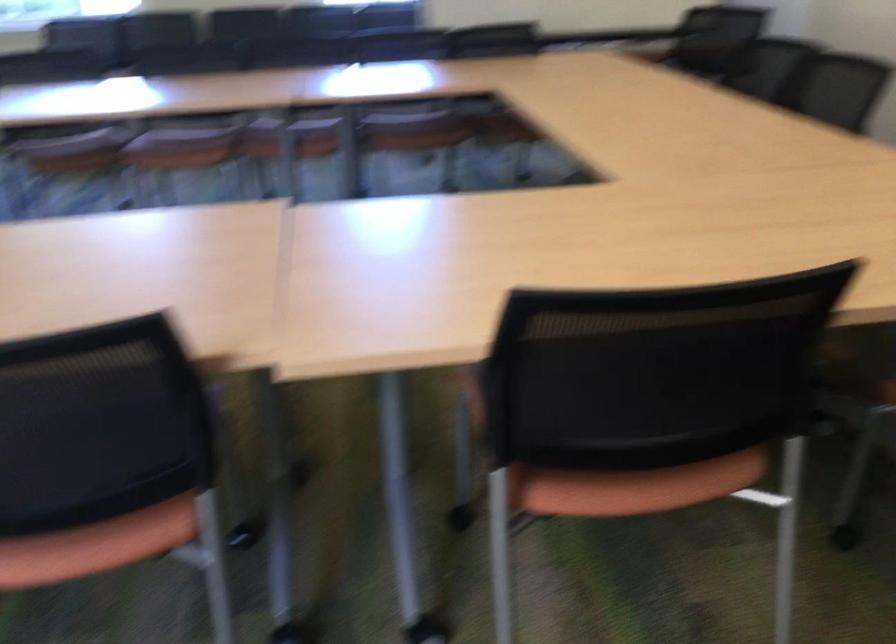
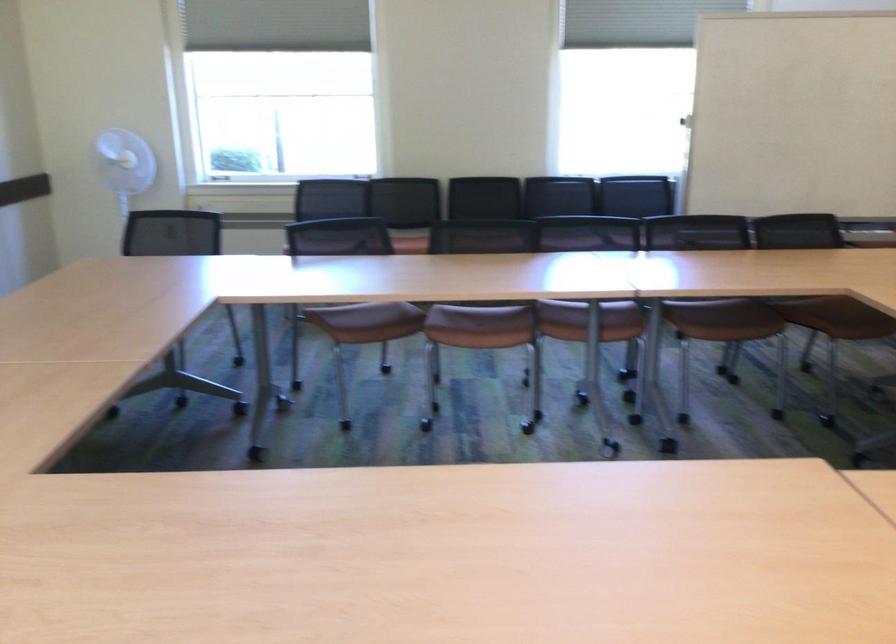
Where in the second image is the point corresponding to point 445,89 from the first image?

(820, 295)